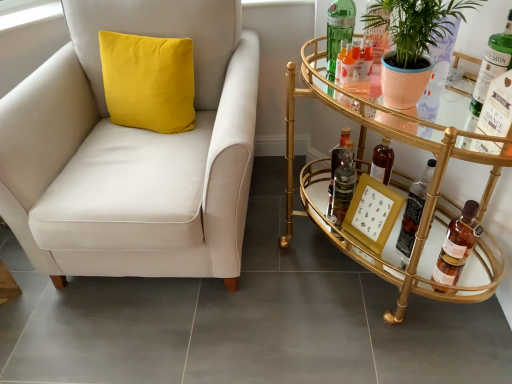
Question: Should I look upward or downward to see brown glass bottle at lower right, which appears as the sixth bottle when viewed from the left?

Choices:
 (A) up
 (B) down

Answer: (B)

Question: Is matte peach pot at right at the left side of translucent glass bottle at right, which is the fourth bottle from right to left?

Choices:
 (A) no
 (B) yes

Answer: (B)

Question: Is the depth of matte peach pot at right less than that of translucent glass bottle at right, which is the fourth bottle from right to left?

Choices:
 (A) yes
 (B) no

Answer: (A)

Question: Considering the relative sizes of matte peach pot at right and translucent glass bottle at right, which is the third bottle in left-to-right order, in the image provided, is matte peach pot at right thinner than translucent glass bottle at right, which is the third bottle in left-to-right order,?

Choices:
 (A) yes
 (B) no

Answer: (B)

Question: Is the surface of matte peach pot at right in direct contact with translucent glass bottle at right, which is the fourth bottle from right to left?

Choices:
 (A) no
 (B) yes

Answer: (A)

Question: From the image's perspective, is matte peach pot at right over translucent glass bottle at right, which is the fourth bottle from right to left?

Choices:
 (A) yes
 (B) no

Answer: (A)

Question: From the image's perspective, is matte peach pot at right located beneath translucent glass bottle at right, which is the third bottle in left-to-right order?

Choices:
 (A) yes
 (B) no

Answer: (B)

Question: Is green glass bottle at upper right, the second bottle viewed from the left, surrounding gold mirrored bar cart at right?

Choices:
 (A) no
 (B) yes

Answer: (A)

Question: From the image's perspective, is green glass bottle at upper right, the second bottle viewed from the left, under gold mirrored bar cart at right?

Choices:
 (A) no
 (B) yes

Answer: (A)

Question: From a real-world perspective, is green glass bottle at upper right, the 5th bottle from the right, on top of gold mirrored bar cart at right?

Choices:
 (A) yes
 (B) no

Answer: (A)

Question: Does green glass bottle at upper right, the 5th bottle from the right, appear on the left side of gold mirrored bar cart at right?

Choices:
 (A) no
 (B) yes

Answer: (B)

Question: From a real-world perspective, is green glass bottle at upper right, the 5th bottle from the right, physically below gold mirrored bar cart at right?

Choices:
 (A) yes
 (B) no

Answer: (B)

Question: Considering the relative sizes of green glass bottle at upper right, the 5th bottle from the right, and gold mirrored bar cart at right in the image provided, is green glass bottle at upper right, the 5th bottle from the right, bigger than gold mirrored bar cart at right?

Choices:
 (A) yes
 (B) no

Answer: (B)

Question: Is matte peach pot at right outside translucent glass bottle at lower right, arranged as the 3th bottle when viewed from the right?

Choices:
 (A) no
 (B) yes

Answer: (B)